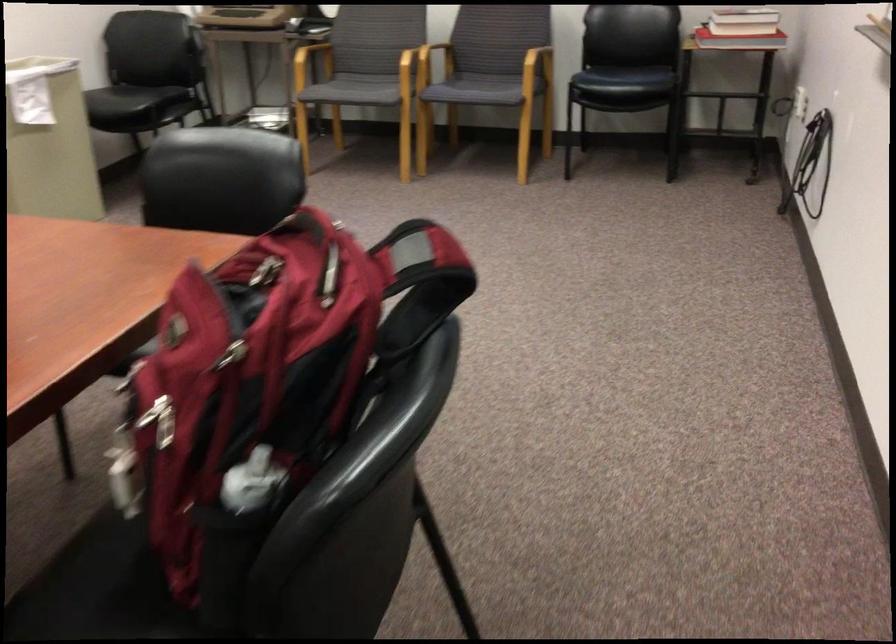
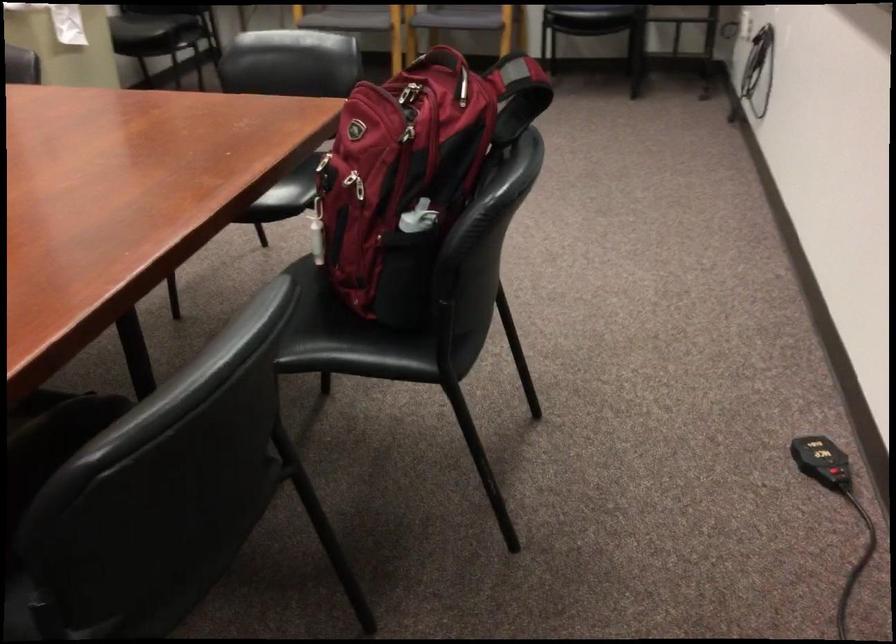
Where in the second image is the point corresponding to point 177,413 from the first image?

(355, 184)